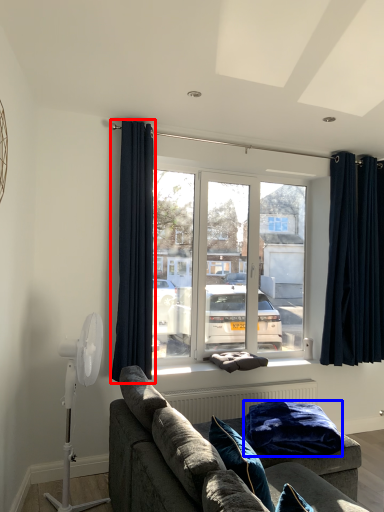
Question: Among these objects, which one is farthest to the camera, curtain (highlighted by a red box) or blanket (highlighted by a blue box)?

Choices:
 (A) curtain
 (B) blanket

Answer: (A)